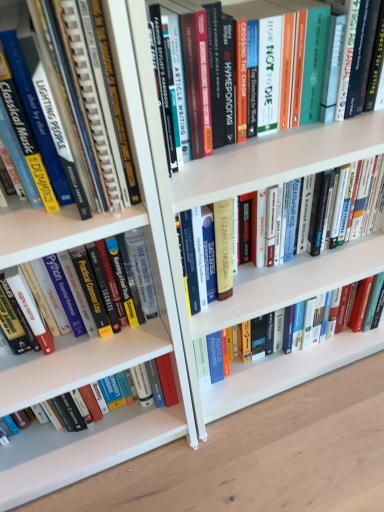
What do you see at coordinates (248, 170) in the screenshot? Image resolution: width=384 pixels, height=512 pixels. I see `hardcover book at center, positioned as the second book in top-to-bottom order` at bounding box center [248, 170].

Measure the distance between hardcover book at lower left, the fifth book viewed from the top, and camera.

hardcover book at lower left, the fifth book viewed from the top, is 30.46 inches away from camera.

This screenshot has width=384, height=512. Describe the element at coordinates (255, 304) in the screenshot. I see `hardcover book at center, which ranks as the fourth book in top-to-bottom order` at that location.

At what (x,y) coordinates should I click in order to perform the action: click on hardcover book at center, marked as the fourth book in a bottom-to-top arrangement. Please return your answer as a coordinate pair (x, y). Looking at the image, I should click on (248, 170).

Between point (271, 277) and point (128, 408), which one is positioned behind?

Point (128, 408)

How different are the orientations of hardcover book at center, the 2th book positioned from the bottom, and hardcover book at lower left, the 1th book from the bottom, in degrees?

There is a 0.527-degree angle between the facing directions of hardcover book at center, the 2th book positioned from the bottom, and hardcover book at lower left, the 1th book from the bottom.

Considering the relative sizes of hardcover book at center, which ranks as the fourth book in top-to-bottom order, and hardcover book at lower left, the 1th book from the bottom, in the image provided, is hardcover book at center, which ranks as the fourth book in top-to-bottom order, taller than hardcover book at lower left, the 1th book from the bottom,?

Yes, hardcover book at center, which ranks as the fourth book in top-to-bottom order, is taller than hardcover book at lower left, the 1th book from the bottom.

In the scene shown: Measure the distance between hardcover book at center, which ranks as the fourth book in top-to-bottom order, and hardcover book at lower left, the fifth book viewed from the top.

hardcover book at center, which ranks as the fourth book in top-to-bottom order, and hardcover book at lower left, the fifth book viewed from the top, are 10.36 inches apart from each other.

From the picture: Can you tell me how much hardcover book at center, the fifth book when ordered from bottom to top, and hardcover book at left, the 3th book ordered from the bottom, differ in facing direction?

There is a 0.759-degree angle between the facing directions of hardcover book at center, the fifth book when ordered from bottom to top, and hardcover book at left, the 3th book ordered from the bottom.

From the image's perspective, is hardcover book at center, acting as the 1th book starting from the top, positioned above or below hardcover book at left, the 3th book ordered from the bottom?

hardcover book at center, acting as the 1th book starting from the top, is situated higher than hardcover book at left, the 3th book ordered from the bottom, in the image.

Based on the photo, from a real-world perspective, which object rests below the other?

hardcover book at left, the 3th book ordered from the bottom, from a real-world perspective.

Considering the points (342, 39) and (70, 270), which point is behind, point (342, 39) or point (70, 270)?

The point (70, 270) is farther.

From a real-world perspective, is hardcover book at left, the 3th book ordered from the bottom, positioned over hardcover book at lower left, the 1th book from the bottom, based on gravity?

Yes.

Which is more to the left, hardcover book at left, which ranks as the 3th book in top-to-bottom order, or hardcover book at lower left, the fifth book viewed from the top?

Positioned to the left is hardcover book at left, which ranks as the 3th book in top-to-bottom order.

Is hardcover book at left, which ranks as the 3th book in top-to-bottom order, wider than hardcover book at lower left, the 1th book from the bottom?

Correct, the width of hardcover book at left, which ranks as the 3th book in top-to-bottom order, exceeds that of hardcover book at lower left, the 1th book from the bottom.

How distant is hardcover book at left, which ranks as the 3th book in top-to-bottom order, from hardcover book at lower left, the fifth book viewed from the top?

hardcover book at left, which ranks as the 3th book in top-to-bottom order, is 8.02 centimeters from hardcover book at lower left, the fifth book viewed from the top.

Is hardcover book at center, positioned as the second book in top-to-bottom order, to the left or to the right of hardcover book at lower left, the 1th book from the bottom, in the image?

Based on their positions, hardcover book at center, positioned as the second book in top-to-bottom order, is located to the right of hardcover book at lower left, the 1th book from the bottom.

Which object is further away from the camera, hardcover book at center, positioned as the second book in top-to-bottom order, or hardcover book at lower left, the fifth book viewed from the top?

hardcover book at lower left, the fifth book viewed from the top.

This screenshot has height=512, width=384. In order to click on the 2nd book to the right of the hardcover book at lower left, the fifth book viewed from the top, starting your count from the anchor in this screenshot , I will do `click(248, 170)`.

Is hardcover book at center, marked as the fourth book in a bottom-to-top arrangement, bigger than hardcover book at lower left, the fifth book viewed from the top?

Correct, hardcover book at center, marked as the fourth book in a bottom-to-top arrangement, is larger in size than hardcover book at lower left, the fifth book viewed from the top.

From the image's perspective, is hardcover book at center, which ranks as the fourth book in top-to-bottom order, located above or below hardcover book at center, acting as the 1th book starting from the top?

hardcover book at center, which ranks as the fourth book in top-to-bottom order, is situated lower than hardcover book at center, acting as the 1th book starting from the top, in the image.

Which object is further away from the camera, hardcover book at center, which ranks as the fourth book in top-to-bottom order, or hardcover book at center, acting as the 1th book starting from the top?

hardcover book at center, which ranks as the fourth book in top-to-bottom order.

Considering the positions of points (237, 286) and (213, 83), is point (237, 286) closer to camera compared to point (213, 83)?

That is False.

Based on the photo, is hardcover book at center, the 2th book positioned from the bottom, at the back of hardcover book at left, the 3th book ordered from the bottom?

No, hardcover book at center, the 2th book positioned from the bottom, is not at the back of hardcover book at left, the 3th book ordered from the bottom.

Where is `the 1st book below the hardcover book at left, the 3th book ordered from the bottom (from the image's perspective)`? the 1st book below the hardcover book at left, the 3th book ordered from the bottom (from the image's perspective) is located at coordinates (255, 304).

Can you see hardcover book at left, which ranks as the 3th book in top-to-bottom order, touching hardcover book at center, which ranks as the fourth book in top-to-bottom order?

hardcover book at left, which ranks as the 3th book in top-to-bottom order, and hardcover book at center, which ranks as the fourth book in top-to-bottom order, are not in contact.

Is hardcover book at left, the 3th book ordered from the bottom, wider or thinner than hardcover book at center, which ranks as the fourth book in top-to-bottom order?

hardcover book at left, the 3th book ordered from the bottom, is wider than hardcover book at center, which ranks as the fourth book in top-to-bottom order.

Is point (296, 2) farther from camera compared to point (226, 361)?

No, it is not.

Could you tell me if hardcover book at center, acting as the 1th book starting from the top, is facing hardcover book at center, which ranks as the fourth book in top-to-bottom order?

No, hardcover book at center, acting as the 1th book starting from the top, is not oriented towards hardcover book at center, which ranks as the fourth book in top-to-bottom order.

From a real-world perspective, is hardcover book at center, the fifth book when ordered from bottom to top, positioned above or below hardcover book at center, the 2th book positioned from the bottom?

hardcover book at center, the fifth book when ordered from bottom to top, is above hardcover book at center, the 2th book positioned from the bottom.

From the image's perspective, is hardcover book at center, acting as the 1th book starting from the top, above or below hardcover book at center, which ranks as the fourth book in top-to-bottom order?

hardcover book at center, acting as the 1th book starting from the top, is situated higher than hardcover book at center, which ranks as the fourth book in top-to-bottom order, in the image.

Identify the location of the 3rd book counting from the left side of the hardcover book at center, the 2th book positioned from the bottom. The width and height of the screenshot is (384, 512). (59, 372).

This screenshot has width=384, height=512. Find the location of `book above the hardcover book at left, the 3th book ordered from the bottom (from a real-world perspective)`. book above the hardcover book at left, the 3th book ordered from the bottom (from a real-world perspective) is located at coordinates (303, 46).

From the picture: Based on their spatial positions, is hardcover book at lower left, the fifth book viewed from the top, or hardcover book at center, the 2th book positioned from the bottom, closer to hardcover book at left, the 3th book ordered from the bottom?

The object closer to hardcover book at left, the 3th book ordered from the bottom, is hardcover book at lower left, the fifth book viewed from the top.

Based on their spatial positions, is hardcover book at center, marked as the fourth book in a bottom-to-top arrangement, or hardcover book at left, which ranks as the 3th book in top-to-bottom order, closer to hardcover book at center, acting as the 1th book starting from the top?

hardcover book at center, marked as the fourth book in a bottom-to-top arrangement.

Which object lies further to the anchor point hardcover book at center, positioned as the second book in top-to-bottom order, hardcover book at left, which ranks as the 3th book in top-to-bottom order, or hardcover book at center, acting as the 1th book starting from the top?

hardcover book at left, which ranks as the 3th book in top-to-bottom order, is further to hardcover book at center, positioned as the second book in top-to-bottom order.

Considering their positions, is hardcover book at center, acting as the 1th book starting from the top, positioned closer to hardcover book at lower left, the 1th book from the bottom, than hardcover book at left, which ranks as the 3th book in top-to-bottom order?

hardcover book at left, which ranks as the 3th book in top-to-bottom order, is closer to hardcover book at lower left, the 1th book from the bottom.

Based on the photo, estimate the real-world distances between objects in this image. Which object is further from hardcover book at center, positioned as the second book in top-to-bottom order, hardcover book at lower left, the fifth book viewed from the top, or hardcover book at center, the 2th book positioned from the bottom?

The object further to hardcover book at center, positioned as the second book in top-to-bottom order, is hardcover book at lower left, the fifth book viewed from the top.

Based on their spatial positions, is hardcover book at center, the 2th book positioned from the bottom, or hardcover book at left, which ranks as the 3th book in top-to-bottom order, closer to hardcover book at lower left, the fifth book viewed from the top?

hardcover book at left, which ranks as the 3th book in top-to-bottom order, is closer to hardcover book at lower left, the fifth book viewed from the top.

Considering their positions, is hardcover book at center, the 2th book positioned from the bottom, positioned further to hardcover book at lower left, the fifth book viewed from the top, than hardcover book at center, marked as the fourth book in a bottom-to-top arrangement?

hardcover book at center, marked as the fourth book in a bottom-to-top arrangement, is further to hardcover book at lower left, the fifth book viewed from the top.

Considering their positions, is hardcover book at lower left, the 1th book from the bottom, positioned further to hardcover book at left, which ranks as the 3th book in top-to-bottom order, than hardcover book at center, positioned as the second book in top-to-bottom order?

Among the two, hardcover book at center, positioned as the second book in top-to-bottom order, is located further to hardcover book at left, which ranks as the 3th book in top-to-bottom order.